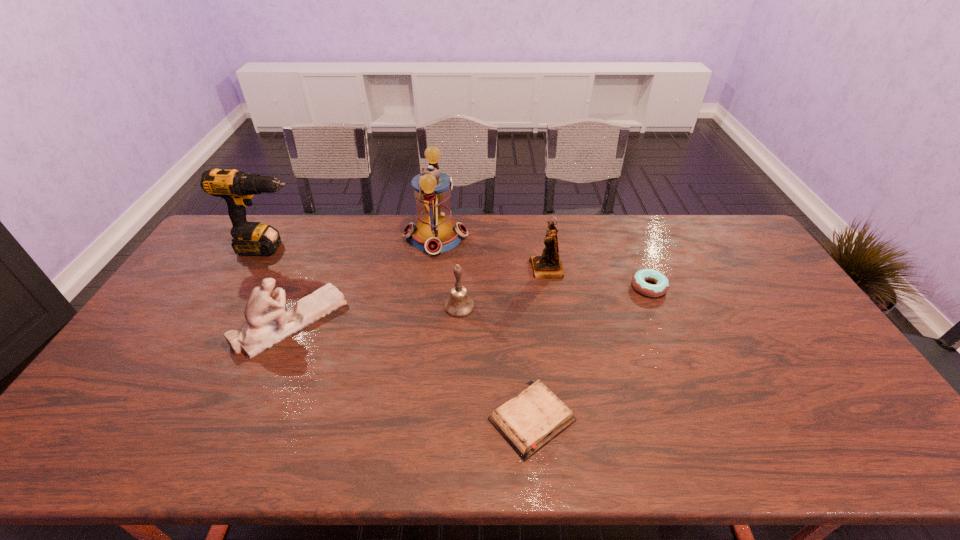
What are the coordinates of `free space between the nearer figurine and the lantern` in the screenshot? It's located at (364, 279).

The height and width of the screenshot is (540, 960). What are the coordinates of `vacant area that lies between the shortest object and the farther figurine` in the screenshot? It's located at (540, 345).

In order to click on free space that is in between the shortest object and the drill in this screenshot , I will do `click(401, 334)`.

Identify the location of blank region between the second shortest object and the farther figurine. The height and width of the screenshot is (540, 960). (598, 278).

Image resolution: width=960 pixels, height=540 pixels. I want to click on free space between the shortest object and the second shortest object, so click(x=590, y=353).

I want to click on blank region between the lantern and the right figurine, so point(492,253).

Identify the location of free space between the lantern and the nearest object. Image resolution: width=960 pixels, height=540 pixels. (x=484, y=328).

Locate which object ranks sixth in proximity to the shorter figurine. Please provide its 2D coordinates. Your answer should be formatted as a tuple, i.e. [(x, y)], where the tuple contains the x and y coordinates of a point satisfying the conditions above.

[(638, 280)]

Identify which object is the fifth closest to the right figurine. Please provide its 2D coordinates. Your answer should be formatted as a tuple, i.e. [(x, y)], where the tuple contains the x and y coordinates of a point satisfying the conditions above.

[(268, 324)]

Image resolution: width=960 pixels, height=540 pixels. Identify the location of free space in the image that satisfies the following two spatial constraints: 1. on the front side of the doughnut; 2. on the front-facing side of the left figurine. (663, 322).